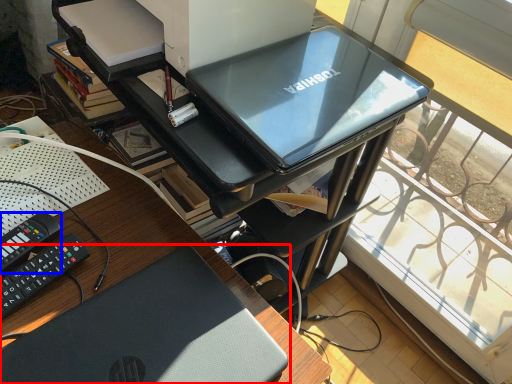
Question: Which of the following is the farthest to the observer, laptop (highlighted by a red box) or equipment (highlighted by a blue box)?

Choices:
 (A) laptop
 (B) equipment

Answer: (B)